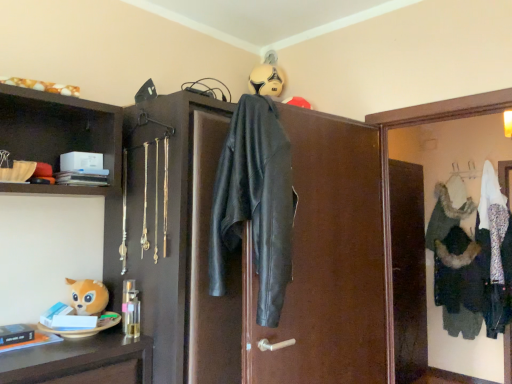
Question: Is white fur coat at center next to white fabric medicine cabinet at upper right and touching it?

Choices:
 (A) yes
 (B) no

Answer: (B)

Question: Could you tell me if white fur coat at center is facing white fabric medicine cabinet at upper right?

Choices:
 (A) no
 (B) yes

Answer: (B)

Question: Can you confirm if white fur coat at center is positioned to the left of white fabric medicine cabinet at upper right?

Choices:
 (A) no
 (B) yes

Answer: (A)

Question: Does white fur coat at center appear on the right side of white fabric medicine cabinet at upper right?

Choices:
 (A) yes
 (B) no

Answer: (A)

Question: Considering the relative sizes of white fur coat at center and white fabric medicine cabinet at upper right in the image provided, is white fur coat at center wider than white fabric medicine cabinet at upper right?

Choices:
 (A) no
 (B) yes

Answer: (B)

Question: Is white fabric medicine cabinet at upper right bigger or smaller than black leather jacket at center?

Choices:
 (A) big
 (B) small

Answer: (B)

Question: In terms of width, does white fabric medicine cabinet at upper right look wider or thinner when compared to black leather jacket at center?

Choices:
 (A) wide
 (B) thin

Answer: (B)

Question: Visually, is white fabric medicine cabinet at upper right positioned to the left or to the right of black leather jacket at center?

Choices:
 (A) left
 (B) right

Answer: (B)

Question: Considering their positions, is white fabric medicine cabinet at upper right located in front of or behind black leather jacket at center?

Choices:
 (A) front
 (B) behind

Answer: (B)

Question: In terms of size, does black leather jacket at center appear bigger or smaller than white fur coat at center?

Choices:
 (A) small
 (B) big

Answer: (B)

Question: Is black leather jacket at center wider or thinner than white fur coat at center?

Choices:
 (A) thin
 (B) wide

Answer: (A)

Question: From a real-world perspective, is black leather jacket at center positioned above or below white fur coat at center?

Choices:
 (A) above
 (B) below

Answer: (A)

Question: From the image's perspective, is black leather jacket at center located above or below white fur coat at center?

Choices:
 (A) above
 (B) below

Answer: (A)

Question: Which is correct: white fabric medicine cabinet at upper right is inside white fur coat at center, or outside of it?

Choices:
 (A) inside
 (B) outside

Answer: (B)

Question: Does point (385, 266) appear closer or farther from the camera than point (501, 269)?

Choices:
 (A) farther
 (B) closer

Answer: (B)